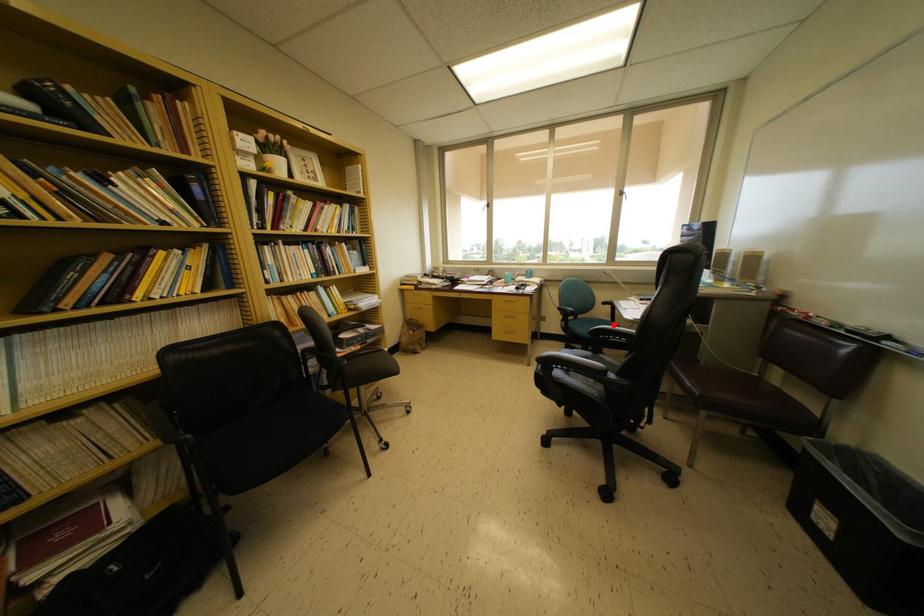
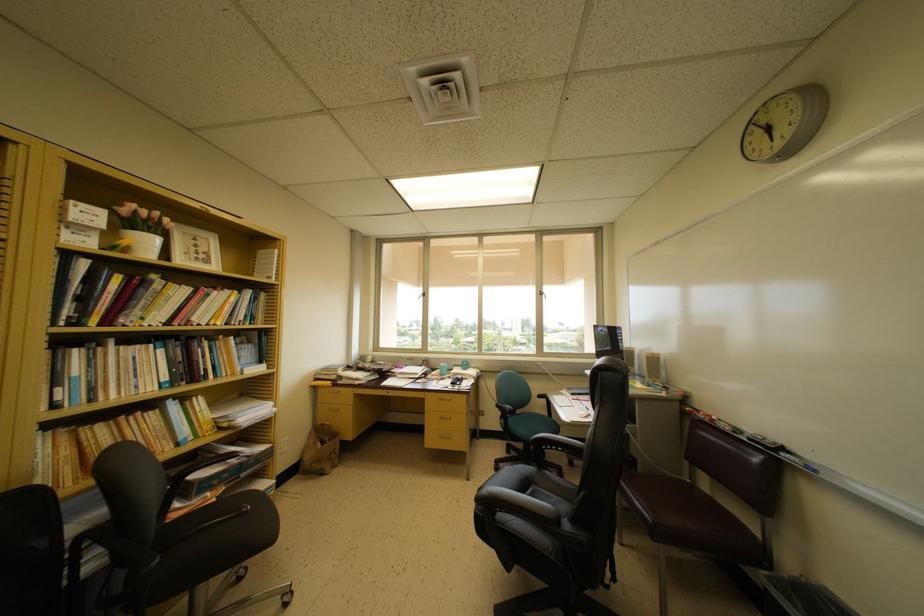
The point at the highlighted location is marked in the first image. Where is the corresponding point in the second image?

(551, 419)